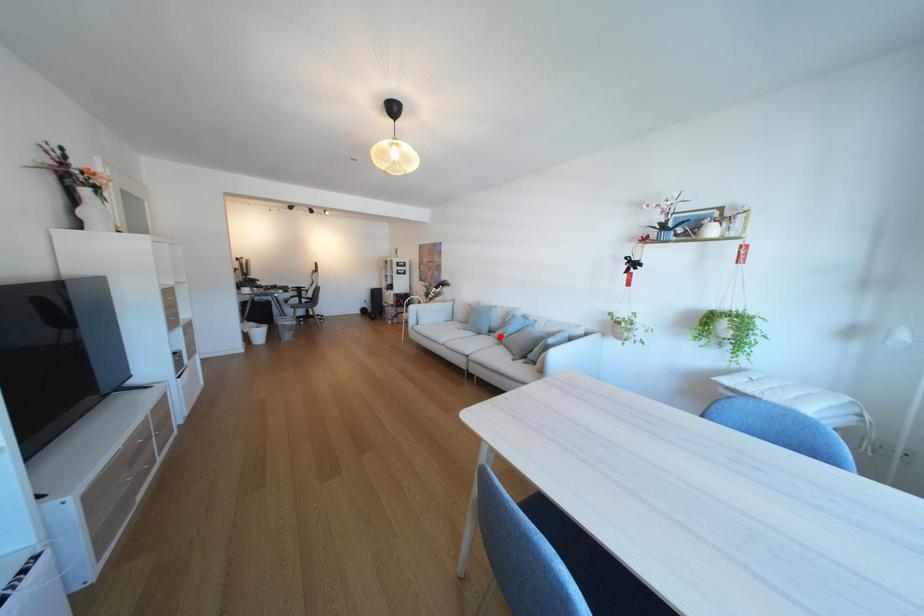
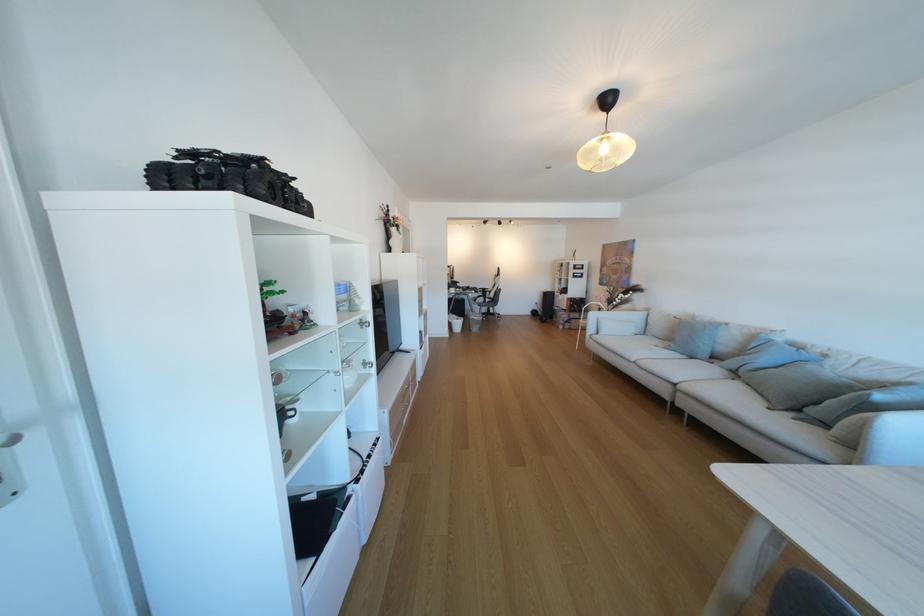
Question: I am providing you with two images of the same scene from different viewpoints. A red point is shown in image1. For the corresponding object point in image2, is it positioned nearer or farther from the camera?

Choices:
 (A) Nearer
 (B) Farther

Answer: (A)